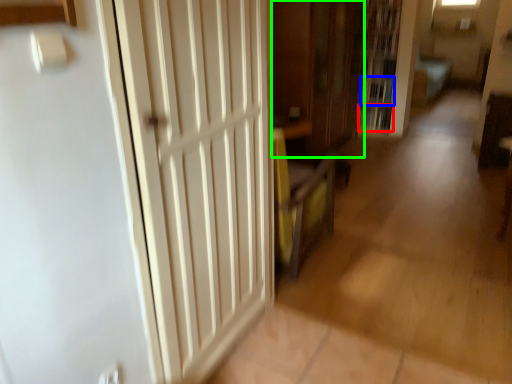
Question: Estimate the real-world distances between objects in this image. Which object is farther from book (highlighted by a red box), book (highlighted by a blue box) or cabinetry (highlighted by a green box)?

Choices:
 (A) book
 (B) cabinetry

Answer: (B)